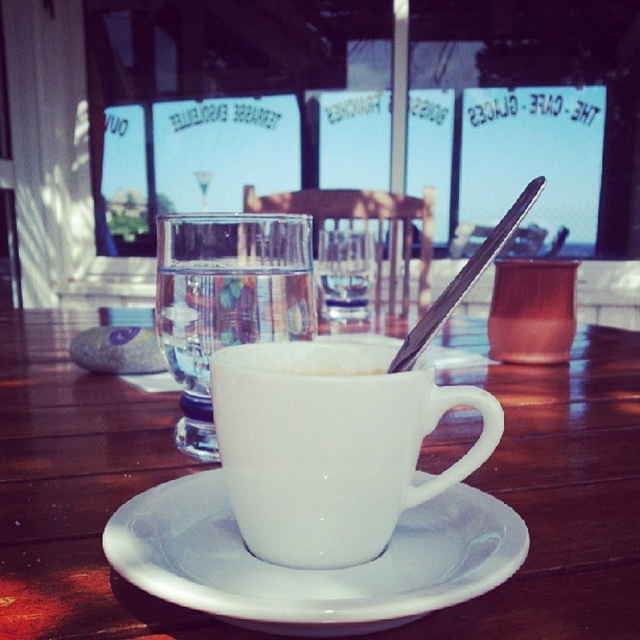
Does clear glass water at center appear on the left side of silver metallic spoon at upper center?

Yes, clear glass water at center is to the left of silver metallic spoon at upper center.

Looking at this image, is clear glass water at center bigger than silver metallic spoon at upper center?

Yes, clear glass water at center is bigger than silver metallic spoon at upper center.

This screenshot has height=640, width=640. What do you see at coordinates (227, 300) in the screenshot?
I see `clear glass water at center` at bounding box center [227, 300].

You are a GUI agent. You are given a task and a screenshot of the screen. Output one action in this format:
    pyautogui.click(x=<x>, y=<y>)
    Task: Click on the clear glass water at center
    This screenshot has height=640, width=640.
    Given the screenshot: What is the action you would take?
    pyautogui.click(x=227, y=300)

Consider the image. Between white ceramic cup at center and white ceramic mug at center, which one is positioned higher?

white ceramic cup at center is above.

Measure the distance between point [604,580] and camera.

They are 9.05 inches apart.

Between point (589, 344) and point (225, 428), which one is positioned in front?

Positioned in front is point (225, 428).

The height and width of the screenshot is (640, 640). In order to click on white ceramic cup at center in this screenshot , I will do `click(77, 492)`.

Who is more distant from viewer, (620, 448) or (520, 205)?

Point (620, 448)

How much distance is there between white ceramic cup at center and silver metallic spoon at upper center?

white ceramic cup at center is 9.31 inches away from silver metallic spoon at upper center.

Measure the distance between point (580, 342) and camera.

Point (580, 342) is 27.05 inches away from camera.

Locate an element on the screen. This screenshot has width=640, height=640. white ceramic cup at center is located at coordinates (77, 492).